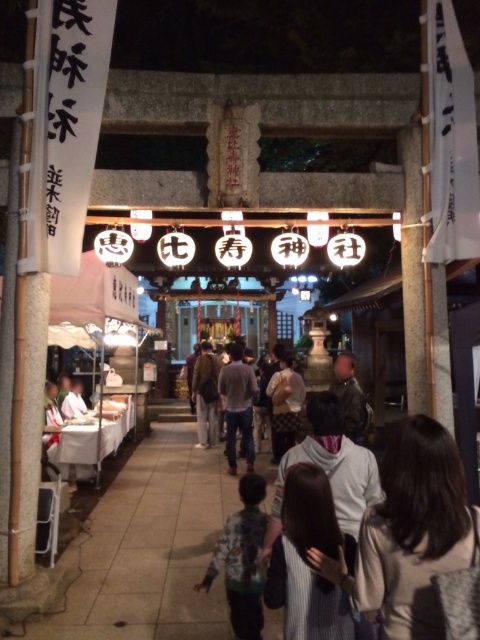
You are standing in front of the Ebisu Shrine torii gate and see both the camouflage jacket at center and the brown leather jacket at center. Which jacket is positioned lower in the scene?

The camouflage jacket at center is located below the brown leather jacket at center, so it is positioned lower in the scene.

You are standing in front of the stone torii gate at Ebisu Shrine and see a dark gray sweater at center and a brown leather jacket at center. Which one is more to the right?

The dark gray sweater at center is more to the right than the brown leather jacket at center.